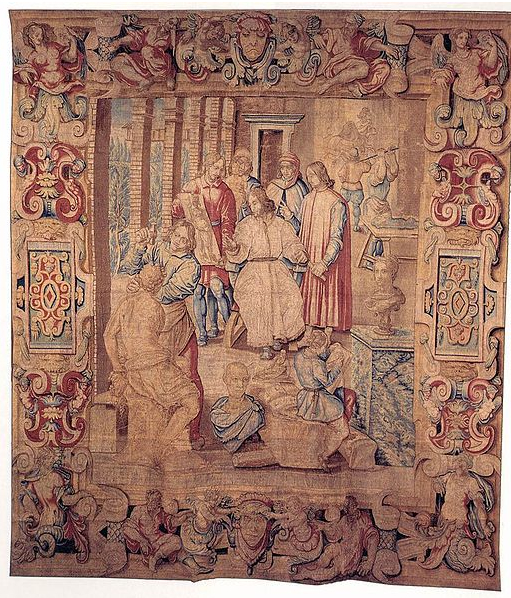
Find the location of `left chair leg`. left chair leg is located at coordinates (229, 323).